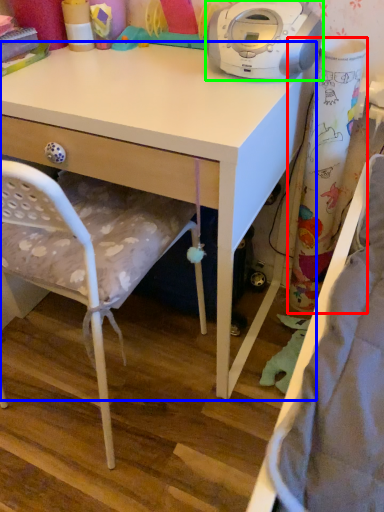
Question: Which is nearer to the curtain (highlighted by a red box)? desk (highlighted by a blue box) or home appliance (highlighted by a green box).

Choices:
 (A) desk
 (B) home appliance

Answer: (B)